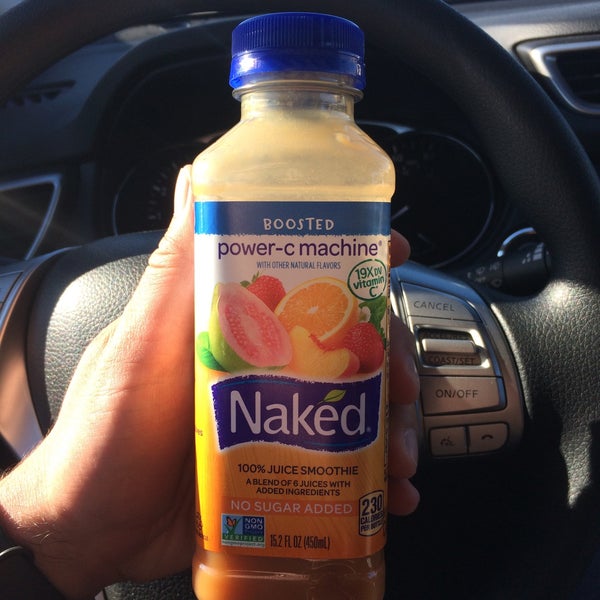
This screenshot has width=600, height=600. Identify the location of 1 juice bottle. (325, 153).